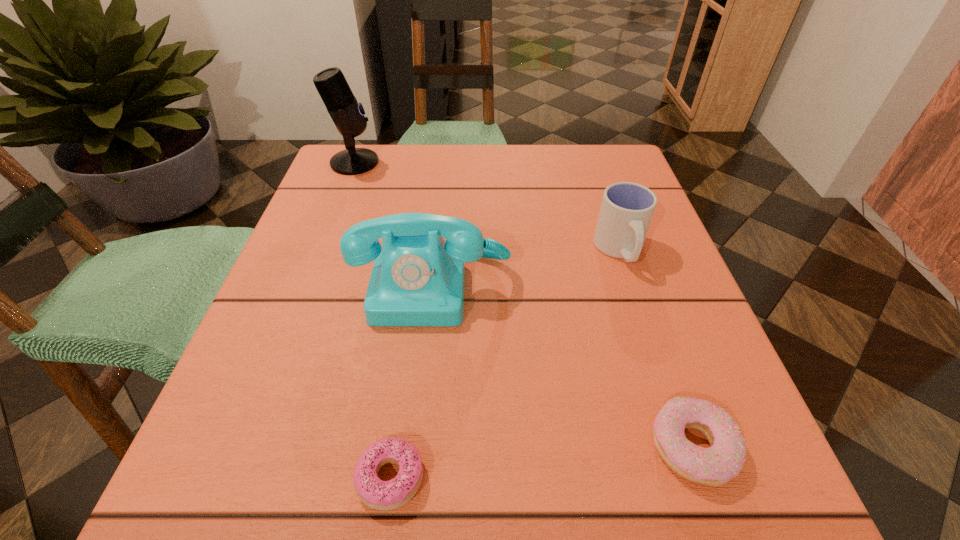
In the image, there is a desktop. At what (x,y) coordinates should I click in order to perform the action: click on vacant region at the far edge. Please return your answer as a coordinate pair (x, y). Image resolution: width=960 pixels, height=540 pixels. Looking at the image, I should click on (514, 143).

Locate an element on the screen. Image resolution: width=960 pixels, height=540 pixels. free region at the near edge of the desktop is located at coordinates (588, 477).

Where is `free space at the left edge`? free space at the left edge is located at coordinates (324, 202).

In the image, there is a desktop. What are the coordinates of `free space at the right edge` in the screenshot? It's located at (639, 395).

This screenshot has width=960, height=540. I want to click on vacant space at the far left corner of the desktop, so click(x=348, y=198).

The image size is (960, 540). In the image, there is a desktop. In order to click on vacant area at the near left corner in this screenshot , I will do `click(307, 457)`.

In the image, there is a desktop. Where is `vacant space at the far right corner`? vacant space at the far right corner is located at coordinates (624, 146).

Where is `empty space that is in between the farthest object and the second shortest object`? empty space that is in between the farthest object and the second shortest object is located at coordinates (523, 305).

Where is `unoccupied area between the microphone and the fourth tallest object`? The image size is (960, 540). unoccupied area between the microphone and the fourth tallest object is located at coordinates (523, 305).

Where is `empty location between the tallest object and the third shortest object`? The height and width of the screenshot is (540, 960). empty location between the tallest object and the third shortest object is located at coordinates (487, 206).